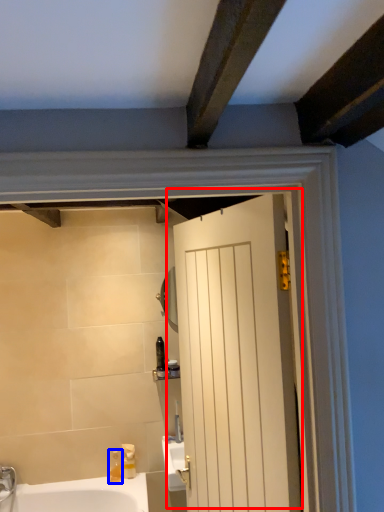
Question: Which object appears farthest to the camera in this image, door (highlighted by a red box) or soap dispenser (highlighted by a blue box)?

Choices:
 (A) door
 (B) soap dispenser

Answer: (B)